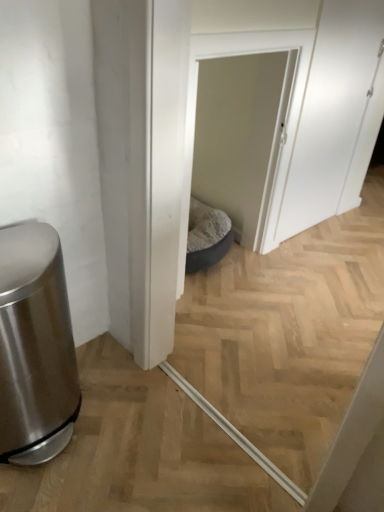
Question: In terms of size, does white matte screen door at upper right, the second screen door when ordered from left to right, appear bigger or smaller than brushed metal trash can at left?

Choices:
 (A) big
 (B) small

Answer: (B)

Question: From the image's perspective, is white matte screen door at upper right, the second screen door when ordered from left to right, positioned above or below brushed metal trash can at left?

Choices:
 (A) above
 (B) below

Answer: (A)

Question: Which is nearer to the brushed metal trash can at left?

Choices:
 (A) white fabric pet bed at center, the second screen door when ordered from right to left
 (B) white matte screen door at upper right, which is the 1th screen door from right to left

Answer: (A)

Question: Which is nearer to the white fabric pet bed at center, arranged as the 1th screen door when viewed from the left?

Choices:
 (A) white matte screen door at upper right, which is the 1th screen door from right to left
 (B) brushed metal trash can at left

Answer: (A)